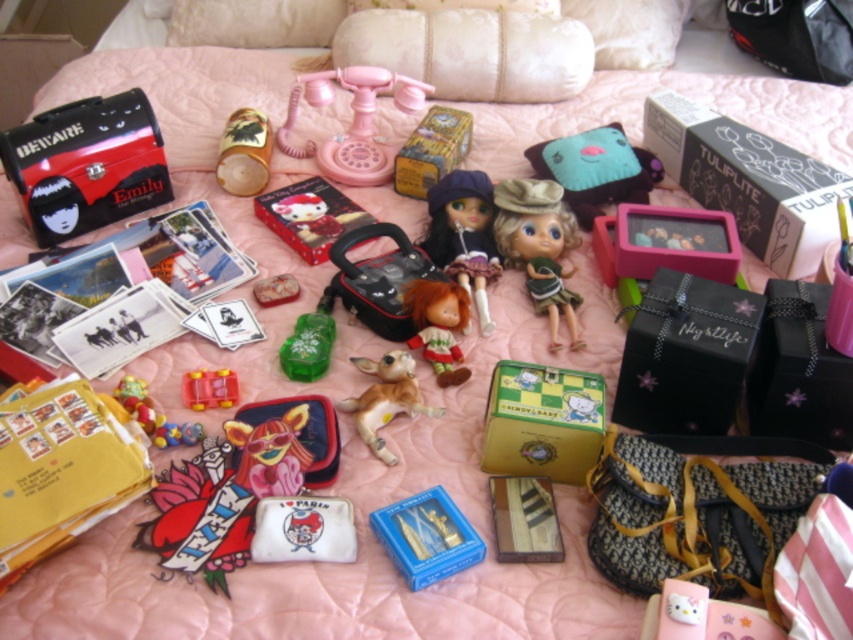
Can you confirm if creamy satin pillow at upper center is positioned above green matte toy at center?

Correct, creamy satin pillow at upper center is located above green matte toy at center.

The height and width of the screenshot is (640, 853). Describe the element at coordinates (471, 51) in the screenshot. I see `creamy satin pillow at upper center` at that location.

Locate an element on the screen. Image resolution: width=853 pixels, height=640 pixels. creamy satin pillow at upper center is located at coordinates [471, 51].

Between pink plastic telephone at center and rubber duck at center, which one is positioned higher?

pink plastic telephone at center is above.

From the picture: Does pink plastic telephone at center appear on the left side of rubber duck at center?

Incorrect, pink plastic telephone at center is not on the left side of rubber duck at center.

Which is in front, point (329, 154) or point (219, 397)?

Point (219, 397) is more forward.

This screenshot has height=640, width=853. In order to click on pink plastic telephone at center in this screenshot , I will do `click(352, 122)`.

Which is below, creamy satin pillow at upper center or matte black toy chest at upper left?

matte black toy chest at upper left is lower down.

Which of these two, creamy satin pillow at upper center or matte black toy chest at upper left, stands shorter?

creamy satin pillow at upper center

Describe the element at coordinates (471, 51) in the screenshot. I see `creamy satin pillow at upper center` at that location.

The height and width of the screenshot is (640, 853). I want to click on creamy satin pillow at upper center, so click(471, 51).